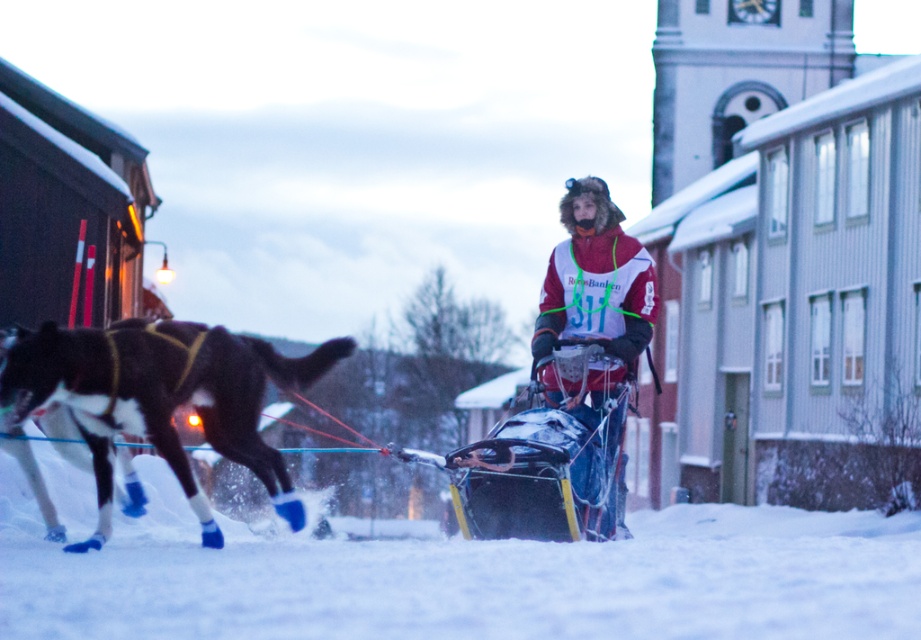
Question: Which point is farther from the camera taking this photo?

Choices:
 (A) (132, 381)
 (B) (702, 528)
 (C) (605, 333)

Answer: (B)

Question: Is white fluffy snow at lower center to the right of red and white jacket at center from the viewer's perspective?

Choices:
 (A) yes
 (B) no

Answer: (A)

Question: Among these points, which one is nearest to the camera?

Choices:
 (A) tap(206, 368)
 (B) tap(618, 499)
 (C) tap(138, 582)

Answer: (C)

Question: Can you confirm if black fur dog at left is positioned below red and white jacket at center?

Choices:
 (A) yes
 (B) no

Answer: (A)

Question: Does black fur dog at left come in front of red and white jacket at center?

Choices:
 (A) yes
 (B) no

Answer: (A)

Question: Which of the following is the farthest from the observer?

Choices:
 (A) (80, 596)
 (B) (168, 330)

Answer: (B)